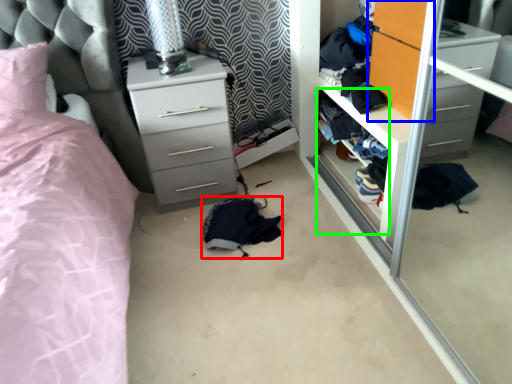
Question: Based on their relative distances, which object is farther from clothing (highlighted by a red box)? Choose from armoire (highlighted by a blue box) and shelf (highlighted by a green box).

Choices:
 (A) armoire
 (B) shelf

Answer: (A)